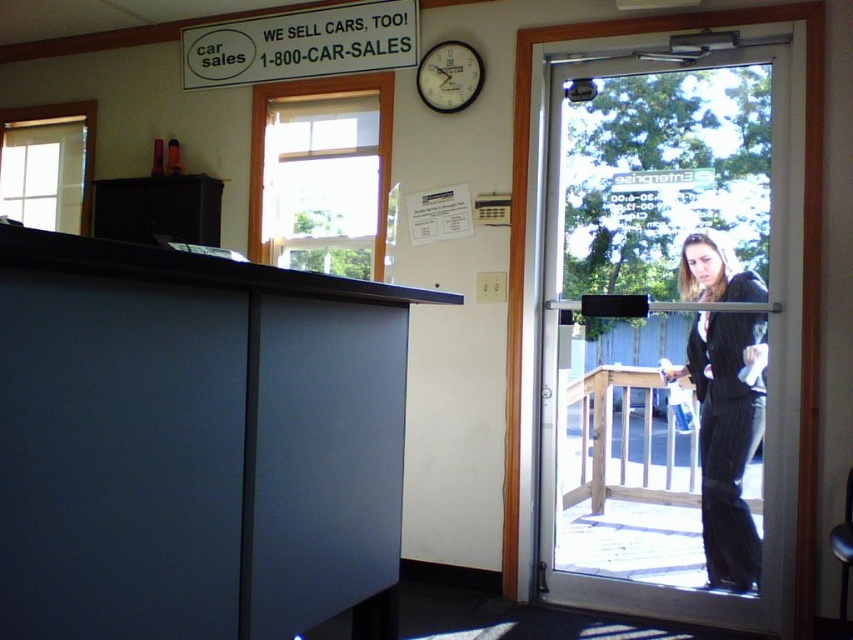
Question: Can you confirm if black pinstripe suit at door is wider than wooden wall clock at upper center?

Choices:
 (A) no
 (B) yes

Answer: (B)

Question: Does transparent glass door at right appear on the left side of wooden wall clock at upper center?

Choices:
 (A) no
 (B) yes

Answer: (A)

Question: Observing the image, what is the correct spatial positioning of transparent glass door at right in reference to black pinstripe suit at door?

Choices:
 (A) right
 (B) left

Answer: (B)

Question: Which point is farther to the camera?

Choices:
 (A) (445, 58)
 (B) (798, 628)

Answer: (A)

Question: Which object appears closest to the camera in this image?

Choices:
 (A) white plastic sign at upper center
 (B) transparent glass door at right
 (C) wooden wall clock at upper center

Answer: (B)

Question: Among these points, which one is farthest from the camera?

Choices:
 (A) (683, 374)
 (B) (181, 52)
 (C) (432, 90)
 (D) (511, 522)

Answer: (B)